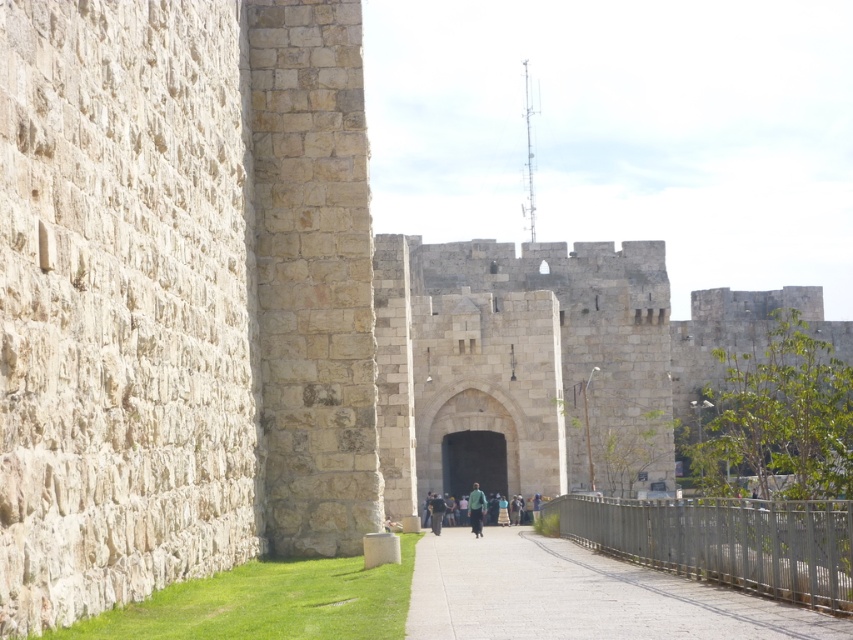
Is stone castle at center wider than green fabric at center?

Correct, the width of stone castle at center exceeds that of green fabric at center.

Is point (553, 298) in front of point (479, 490)?

No, it is not.

Does point (618, 273) come farther from viewer compared to point (473, 522)?

Yes, it is.

Where is `stone castle at center`? stone castle at center is located at coordinates (546, 358).

Is point (445, 456) positioned in front of point (477, 483)?

Yes, point (445, 456) is closer to viewer.

Identify the location of black stone archway at center. 473,461.

Does point (505, 492) come behind point (469, 506)?

That is True.

Identify the location of black stone archway at center. (473, 461).

Consider the image. Between stone castle at center and smooth concrete path at center, which one has more height?

Standing taller between the two is stone castle at center.

Looking at this image, is stone castle at center shorter than smooth concrete path at center?

No.

Where is `stone castle at center`? stone castle at center is located at coordinates (546, 358).

Identify the location of stone castle at center. Image resolution: width=853 pixels, height=640 pixels. (546, 358).